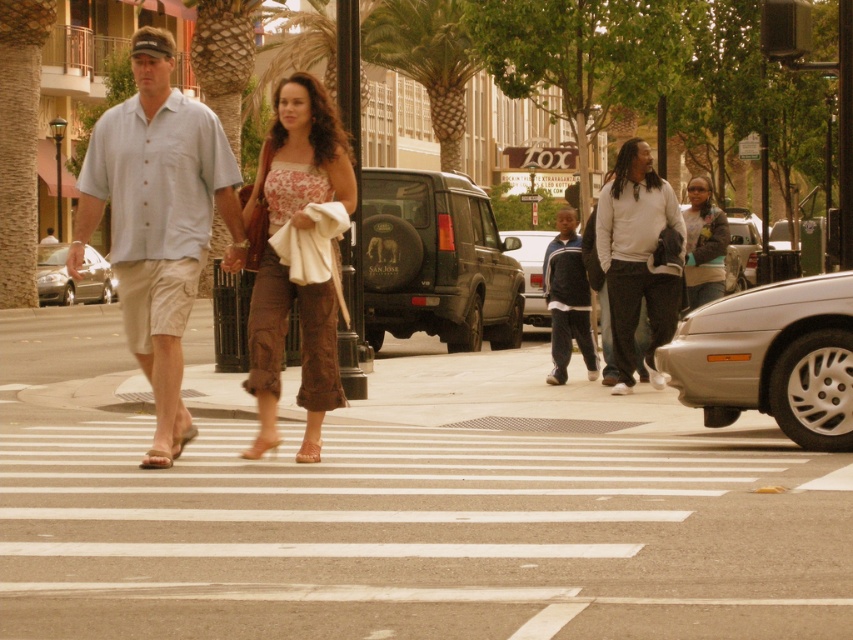
Is metallic gray suv at center taller than denim jacket at right?

Correct, metallic gray suv at center is much taller as denim jacket at right.

Who is positioned more to the left, metallic gray suv at center or denim jacket at right?

metallic gray suv at center

This screenshot has height=640, width=853. I want to click on metallic gray suv at center, so [436, 260].

Between matte white sweater at center and denim jacket at right, which one appears on the left side from the viewer's perspective?

From the viewer's perspective, matte white sweater at center appears more on the left side.

At what (x,y) coordinates should I click in order to perform the action: click on matte white sweater at center. Please return your answer as a coordinate pair (x, y). The width and height of the screenshot is (853, 640). Looking at the image, I should click on (637, 257).

Locate an element on the screen. This screenshot has width=853, height=640. matte white sweater at center is located at coordinates (637, 257).

Does point (798, 284) lie behind point (265, 442)?

That is True.

Which is behind, point (782, 355) or point (245, 452)?

The point (782, 355) is behind.

Is point (802, 339) closer to viewer compared to point (252, 451)?

That is False.

Find the location of a particular element. The image size is (853, 640). silver metallic sedan at lower right is located at coordinates (770, 358).